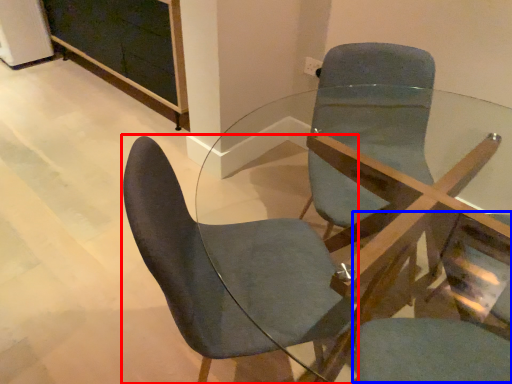
Question: Among these objects, which one is farthest to the camera, chair (highlighted by a red box) or swivel chair (highlighted by a blue box)?

Choices:
 (A) chair
 (B) swivel chair

Answer: (A)